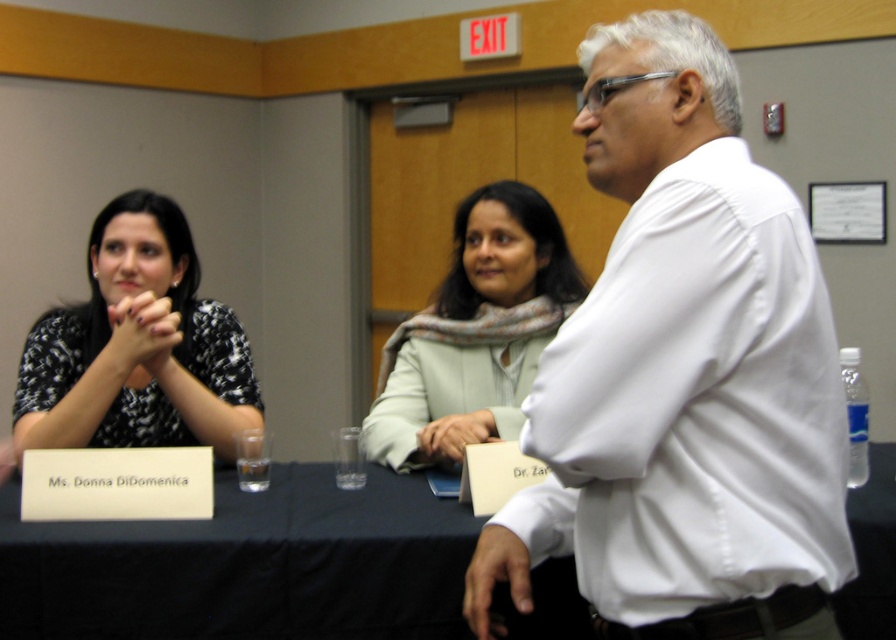
Question: Can you confirm if white shirt at upper right is positioned below matte black hands at center?

Choices:
 (A) yes
 (B) no

Answer: (B)

Question: Which is nearer to the light green fabric scarf at center?

Choices:
 (A) smooth beige hand at center
 (B) white shirt at upper right

Answer: (A)

Question: Among these objects, which one is farthest from the camera?

Choices:
 (A) black fabric table at center
 (B) black dotted dress at left

Answer: (B)

Question: Which point is closer to the camera taking this photo?

Choices:
 (A) (504, 536)
 (B) (458, 260)

Answer: (A)

Question: Does white shirt at upper right have a smaller size compared to light green fabric scarf at center?

Choices:
 (A) no
 (B) yes

Answer: (A)

Question: Is black fabric table at center closer to the viewer compared to black dotted dress at left?

Choices:
 (A) no
 (B) yes

Answer: (B)